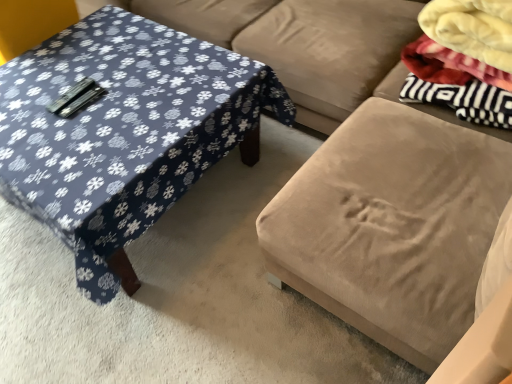
Find the location of a particular element. This screenshot has height=384, width=512. blue fabric-covered table at left is located at coordinates (122, 130).

Is fluffy white blanket at upper right far away from suede couch at center?

No, fluffy white blanket at upper right is not far away from suede couch at center.

Is fluffy white blanket at upper right to the left of suede couch at center from the viewer's perspective?

Incorrect, fluffy white blanket at upper right is not on the left side of suede couch at center.

Is fluffy white blanket at upper right positioned with its back to suede couch at center?

No.

Considering the sizes of objects blue fabric-covered table at left and fluffy white blanket at upper right in the image provided, who is shorter, blue fabric-covered table at left or fluffy white blanket at upper right?

blue fabric-covered table at left is shorter.

Which object is further away from the camera, blue fabric-covered table at left or fluffy white blanket at upper right?

fluffy white blanket at upper right.

Are blue fabric-covered table at left and fluffy white blanket at upper right beside each other?

They are not placed beside each other.

Considering the sizes of objects blue fabric-covered table at left and fluffy white blanket at upper right in the image provided, who is thinner, blue fabric-covered table at left or fluffy white blanket at upper right?

Thinner between the two is fluffy white blanket at upper right.

Can you confirm if velvet beige ottoman at center is positioned to the left of blue fabric-covered table at left?

In fact, velvet beige ottoman at center is to the right of blue fabric-covered table at left.

From the image's perspective, is velvet beige ottoman at center located beneath blue fabric-covered table at left?

No, from the image's perspective, velvet beige ottoman at center is not below blue fabric-covered table at left.

Looking at their sizes, would you say velvet beige ottoman at center is wider or thinner than blue fabric-covered table at left?

Clearly, velvet beige ottoman at center has less width compared to blue fabric-covered table at left.

Find the location of a particular element. coffee table located behind the velvet beige ottoman at center is located at coordinates (122, 130).

Is blue fabric-covered table at left wider or thinner than suede couch at center?

In the image, blue fabric-covered table at left appears to be wider than suede couch at center.

Could you tell me if blue fabric-covered table at left is turned towards suede couch at center?

No.

Considering the sizes of objects blue fabric-covered table at left and suede couch at center in the image provided, who is taller, blue fabric-covered table at left or suede couch at center?

suede couch at center.

Which is more to the left, blue fabric-covered table at left or suede couch at center?

Positioned to the left is blue fabric-covered table at left.

From the image's perspective, would you say fluffy white blanket at upper right is shown under blue fabric-covered table at left?

Incorrect, from the image's perspective, fluffy white blanket at upper right is higher than blue fabric-covered table at left.

In the scene shown: Is fluffy white blanket at upper right oriented towards blue fabric-covered table at left?

No.

Is fluffy white blanket at upper right thinner than blue fabric-covered table at left?

Correct, the width of fluffy white blanket at upper right is less than that of blue fabric-covered table at left.

Is fluffy white blanket at upper right to the left of velvet beige ottoman at center from the viewer's perspective?

Incorrect, fluffy white blanket at upper right is not on the left side of velvet beige ottoman at center.

Is fluffy white blanket at upper right bigger than velvet beige ottoman at center?

No, fluffy white blanket at upper right is not bigger than velvet beige ottoman at center.

Consider the image. Is fluffy white blanket at upper right surrounding velvet beige ottoman at center?

Definitely not — velvet beige ottoman at center is not inside fluffy white blanket at upper right.

Is fluffy white blanket at upper right closer to the viewer compared to velvet beige ottoman at center?

No.

From a real-world perspective, which is physically below, suede couch at center or velvet beige ottoman at center?

suede couch at center is physically lower.

From the image's perspective, which object appears higher, suede couch at center or velvet beige ottoman at center?

From the image's view, suede couch at center is above.

Can you confirm if suede couch at center is shorter than velvet beige ottoman at center?

Yes.

Does point (214, 0) appear closer or farther from the camera than point (502, 163)?

Point (214, 0).

Locate an element on the screen. This screenshot has height=384, width=512. couch on the left of fluffy white blanket at upper right is located at coordinates (304, 44).

Find the location of a particular element. This screenshot has width=512, height=384. fabric on the right of blue fabric-covered table at left is located at coordinates (463, 43).

Looking at the image, which one is located closer to suede couch at center, velvet beige ottoman at center or blue fabric-covered table at left?

blue fabric-covered table at left is closer to suede couch at center.

Based on their spatial positions, is blue fabric-covered table at left or suede couch at center further from velvet beige ottoman at center?

Based on the image, blue fabric-covered table at left appears to be further to velvet beige ottoman at center.

When comparing their distances from blue fabric-covered table at left, does suede couch at center or fluffy white blanket at upper right seem closer?

suede couch at center.

When comparing their distances from suede couch at center, does blue fabric-covered table at left or fluffy white blanket at upper right seem closer?

Among the two, fluffy white blanket at upper right is located nearer to suede couch at center.

From the image, which object appears to be farther from blue fabric-covered table at left, velvet beige ottoman at center or suede couch at center?

velvet beige ottoman at center is further to blue fabric-covered table at left.

When comparing their distances from blue fabric-covered table at left, does velvet beige ottoman at center or fluffy white blanket at upper right seem further?

The object further to blue fabric-covered table at left is fluffy white blanket at upper right.

Estimate the real-world distances between objects in this image. Which object is closer to blue fabric-covered table at left, fluffy white blanket at upper right or velvet beige ottoman at center?

velvet beige ottoman at center lies closer to blue fabric-covered table at left than the other object.

Based on the photo, based on their spatial positions, is fluffy white blanket at upper right or blue fabric-covered table at left closer to velvet beige ottoman at center?

fluffy white blanket at upper right lies closer to velvet beige ottoman at center than the other object.

Image resolution: width=512 pixels, height=384 pixels. Find the location of `swivel chair situated between suede couch at center and fluffy white blanket at upper right from left to right`. swivel chair situated between suede couch at center and fluffy white blanket at upper right from left to right is located at coordinates (392, 226).

Image resolution: width=512 pixels, height=384 pixels. I want to click on couch between blue fabric-covered table at left and fluffy white blanket at upper right in the horizontal direction, so click(x=304, y=44).

The image size is (512, 384). In order to click on couch between blue fabric-covered table at left and velvet beige ottoman at center in this screenshot , I will do `click(304, 44)`.

What are the coordinates of `swivel chair situated between blue fabric-covered table at left and fluffy white blanket at upper right from left to right` in the screenshot? It's located at (392, 226).